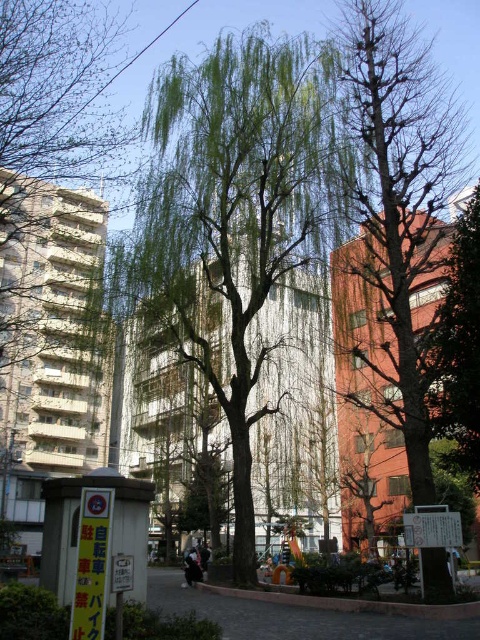
You are a bird looking for a nesting spot. You see the green leafy willow at center and the bare branches tree at right. Which tree is closer to you?

The green leafy willow at center is closer to you because the bare branches tree at right is behind it.

You are standing in the park and want to take a photo of both the green leafy willow at center and the bare branches at right. Which tree should you move closer to first to ensure both are in focus?

You should move closer to the bare branches at right first because the green leafy willow at center is closer to you, so adjusting focus for the bare branches at right which is farther away might require focusing on a middle distance. However, since the green leafy willow is already closer, moving towards the farther one first could help balance the focus.